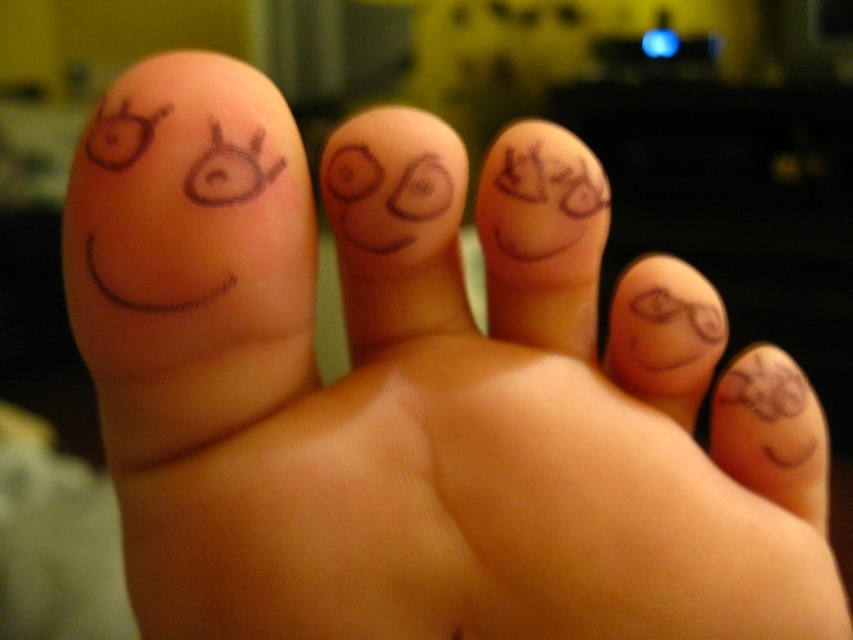
Consider the image. You are a photographer adjusting the focus on your camera. You want to ensure both the matte black toe at upper center and the smooth skin at lower right are clearly visible in the photo. Given their sizes, which object should you focus on first to maintain clarity?

The matte black toe at upper center is much taller than the smooth skin at lower right, so focusing on the matte black toe at upper center first will help maintain clarity for both objects due to its larger size.

You are a photographer adjusting the focus of your camera. You need to ensure that the matte black toe at upper center is in sharp focus. Given that the camera is currently focused on the point at coordinates point [543,237], is the focus correctly set?

Yes, the focus is correctly set because the point [543,237] indicates that the matte black toe at upper center is in sharp focus.

You are a photographer adjusting the camera focus. You want to ensure both the brown ink drawing at left and the matte black toe at upper center are clearly visible. Given their sizes, which object should you focus on first to ensure it is sharp?

The brown ink drawing at left is bigger than the matte black toe at upper center, so you should focus on the brown ink drawing at left first to ensure its larger details are sharp before adjusting for the smaller matte black toe at upper center.